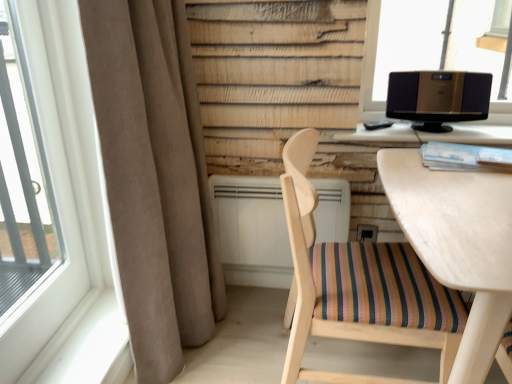
Describe the element at coordinates (428, 135) in the screenshot. I see `black glossy monitor at upper right` at that location.

Where is `transparent glass window at upper right, acting as the first window starting from the right`? transparent glass window at upper right, acting as the first window starting from the right is located at coordinates (399, 44).

This screenshot has height=384, width=512. Identify the location of white plastic window at left, acting as the 2th window starting from the back. (65, 112).

This screenshot has height=384, width=512. Describe the element at coordinates (65, 112) in the screenshot. I see `white plastic window at left, which ranks as the first window in front-to-back order` at that location.

What is the approximate width of metallic silver speaker at upper right?

metallic silver speaker at upper right is 6.78 inches in width.

You are a GUI agent. You are given a task and a screenshot of the screen. Output one action in this format:
    pyautogui.click(x=<x>, y=<y>)
    Task: Click on the wooden table at right
    This screenshot has width=512, height=384.
    Given the screenshot: What is the action you would take?
    pyautogui.click(x=458, y=244)

Where is `window that appears above the black glossy monitor at upper right (from the image's perspective)`? window that appears above the black glossy monitor at upper right (from the image's perspective) is located at coordinates (399, 44).

In the scene shown: Are black glossy monitor at upper right and transparent glass window at upper right, which is the 1th window from back to front, far apart?

No, there isn't a large distance between black glossy monitor at upper right and transparent glass window at upper right, which is the 1th window from back to front.

Between black glossy monitor at upper right and transparent glass window at upper right, acting as the first window starting from the right, which one has larger size?

Bigger between the two is transparent glass window at upper right, acting as the first window starting from the right.

Measure the distance between black glossy monitor at upper right and transparent glass window at upper right, marked as the 2th window in a front-to-back arrangement.

They are 13.09 inches apart.

From a real-world perspective, is wooden table at right over white plastic window at left, which ranks as the second window in right-to-left order?

No, from a real-world perspective, wooden table at right is not over white plastic window at left, which ranks as the second window in right-to-left order

Measure the distance from wooden table at right to white plastic window at left, which ranks as the first window in front-to-back order.

wooden table at right is 3.87 feet from white plastic window at left, which ranks as the first window in front-to-back order.

Considering the relative sizes of wooden table at right and white plastic window at left, which ranks as the first window in front-to-back order, in the image provided, is wooden table at right smaller than white plastic window at left, which ranks as the first window in front-to-back order,?

Actually, wooden table at right might be larger than white plastic window at left, which ranks as the first window in front-to-back order.

Does wooden table at right come in front of white plastic window at left, marked as the first window in a left-to-right arrangement?

Yes, wooden table at right is in front of white plastic window at left, marked as the first window in a left-to-right arrangement.

From the image's perspective, is transparent glass window at upper right, which is the 1th window from back to front, located beneath black glossy monitor at upper right?

Incorrect, from the image's perspective, transparent glass window at upper right, which is the 1th window from back to front, is higher than black glossy monitor at upper right.

Which is more to the left, transparent glass window at upper right, marked as the 2th window in a front-to-back arrangement, or black glossy monitor at upper right?

black glossy monitor at upper right is more to the left.

Is transparent glass window at upper right, marked as the 2th window in a front-to-back arrangement, taller than black glossy monitor at upper right?

Yes.

Which of these two, transparent glass window at upper right, which is the 1th window from back to front, or black glossy monitor at upper right, is bigger?

With larger size is transparent glass window at upper right, which is the 1th window from back to front.

Considering the positions of objects white plastic air conditioner at center and wooden chair with striped cushion at center in the image provided, who is more to the right, white plastic air conditioner at center or wooden chair with striped cushion at center?

From the viewer's perspective, wooden chair with striped cushion at center appears more on the right side.

Consider the image. Looking at their sizes, would you say white plastic air conditioner at center is wider or thinner than wooden chair with striped cushion at center?

Considering their sizes, white plastic air conditioner at center looks slimmer than wooden chair with striped cushion at center.

Is point (226, 241) closer to camera compared to point (408, 287)?

No.

From the picture: Would you consider white plastic air conditioner at center to be distant from wooden chair with striped cushion at center?

No, white plastic air conditioner at center is not far from wooden chair with striped cushion at center.

Between black glossy monitor at upper right and wooden chair with striped cushion at center, which one has smaller width?

With smaller width is black glossy monitor at upper right.

Considering the positions of points (454, 134) and (402, 244), is point (454, 134) farther from camera compared to point (402, 244)?

Yes.

Looking at this image, is black glossy monitor at upper right placed right next to wooden chair with striped cushion at center?

No, black glossy monitor at upper right is not touching wooden chair with striped cushion at center.

Which object is more forward, metallic silver speaker at upper right or transparent glass window at upper right, marked as the 2th window in a front-to-back arrangement?

Positioned in front is metallic silver speaker at upper right.

Does metallic silver speaker at upper right have a larger size compared to transparent glass window at upper right, marked as the second window in a left-to-right arrangement?

No, metallic silver speaker at upper right is not bigger than transparent glass window at upper right, marked as the second window in a left-to-right arrangement.

Is point (477, 75) closer or farther from the camera than point (411, 16)?

Clearly, point (477, 75) is closer to the camera than point (411, 16).

Who is more distant, white plastic air conditioner at center or transparent glass window at upper right, which is the 1th window from back to front?

white plastic air conditioner at center is further away from the camera.

From the image's perspective, is white plastic air conditioner at center below transparent glass window at upper right, acting as the first window starting from the right?

Yes.

Considering the relative sizes of white plastic air conditioner at center and transparent glass window at upper right, marked as the 2th window in a front-to-back arrangement, in the image provided, is white plastic air conditioner at center bigger than transparent glass window at upper right, marked as the 2th window in a front-to-back arrangement,?

Yes, white plastic air conditioner at center is bigger than transparent glass window at upper right, marked as the 2th window in a front-to-back arrangement.

Does white plastic air conditioner at center appear on the left side of transparent glass window at upper right, which is the 1th window from back to front?

Correct, you'll find white plastic air conditioner at center to the left of transparent glass window at upper right, which is the 1th window from back to front.

The width and height of the screenshot is (512, 384). In order to click on window lying on the right of black glossy monitor at upper right in this screenshot , I will do `click(399, 44)`.

Locate an element on the screen. The width and height of the screenshot is (512, 384). table below the white plastic window at left, marked as the first window in a left-to-right arrangement (from a real-world perspective) is located at coordinates (458, 244).

When comparing their distances from black glossy monitor at upper right, does beige fabric curtain at left or wooden table at right seem closer?

wooden table at right is closer to black glossy monitor at upper right.

Looking at the image, which one is located closer to transparent glass window at upper right, marked as the 2th window in a front-to-back arrangement, black glossy monitor at upper right or white plastic air conditioner at center?

black glossy monitor at upper right is closer to transparent glass window at upper right, marked as the 2th window in a front-to-back arrangement.

Looking at the image, which one is located further to beige fabric curtain at left, black glossy monitor at upper right or wooden table at right?

black glossy monitor at upper right is further to beige fabric curtain at left.

Looking at the image, which one is located closer to white plastic window at left, which ranks as the first window in front-to-back order, wooden table at right or white plastic air conditioner at center?

white plastic air conditioner at center.

Which object lies nearer to the anchor point white plastic window at left, which ranks as the second window in right-to-left order, beige fabric curtain at left or black glossy monitor at upper right?

The object closer to white plastic window at left, which ranks as the second window in right-to-left order, is beige fabric curtain at left.

Looking at the image, which one is located further to white plastic window at left, acting as the 2th window starting from the back, wooden chair with striped cushion at center or black glossy monitor at upper right?

black glossy monitor at upper right lies further to white plastic window at left, acting as the 2th window starting from the back, than the other object.

Considering their positions, is wooden table at right positioned further to wooden chair with striped cushion at center than beige fabric curtain at left?

beige fabric curtain at left.

When comparing their distances from white plastic air conditioner at center, does transparent glass window at upper right, marked as the second window in a left-to-right arrangement, or beige fabric curtain at left seem closer?

Among the two, beige fabric curtain at left is located nearer to white plastic air conditioner at center.

Where is `computer monitor between wooden chair with striped cushion at center and white plastic air conditioner at center in the front-back direction`? computer monitor between wooden chair with striped cushion at center and white plastic air conditioner at center in the front-back direction is located at coordinates (438, 98).

At what (x,y) coordinates should I click in order to perform the action: click on air conditioner between beige fabric curtain at left and transparent glass window at upper right, marked as the second window in a left-to-right arrangement, in the horizontal direction. Please return your answer as a coordinate pair (x, y). Image resolution: width=512 pixels, height=384 pixels. Looking at the image, I should click on (252, 231).

At what (x,y) coordinates should I click in order to perform the action: click on air conditioner between white plastic window at left, which ranks as the second window in right-to-left order, and wooden table at right from left to right. Please return your answer as a coordinate pair (x, y). Looking at the image, I should click on (252, 231).

You are a GUI agent. You are given a task and a screenshot of the screen. Output one action in this format:
    pyautogui.click(x=<x>, y=<y>)
    Task: Click on the computer monitor between wooden table at right and transparent glass window at upper right, marked as the second window in a left-to-right arrangement, along the z-axis
    
    Given the screenshot: What is the action you would take?
    pyautogui.click(x=438, y=98)